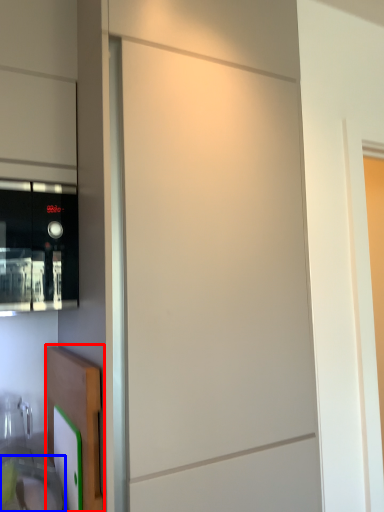
Question: Among these objects, which one is farthest to the camera, cabinetry (highlighted by a red box) or sink (highlighted by a blue box)?

Choices:
 (A) cabinetry
 (B) sink

Answer: (A)